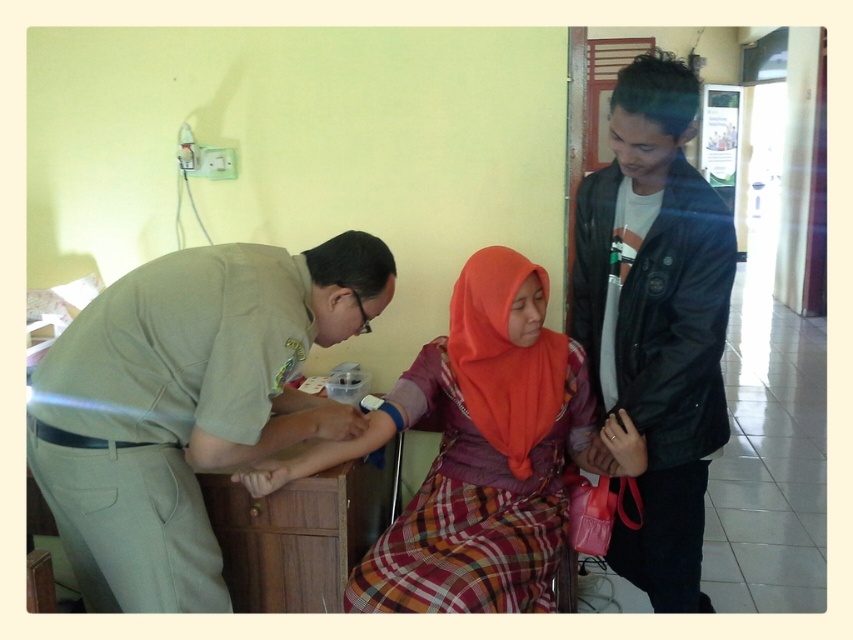
You are a medical technician in the facility. You need to place a small medical kit between the two points labeled point [132,308] and point [604,276]. Based on their positions, will the kit be closer to the wall or the center of the room?

The kit will be closer to the wall because point [132,308] is in front of point [604,276], meaning it is closer to the observer and thus the wall is behind it.

You are a medical technician standing in the scene. You need to reach the point at coordinates (x=85, y=573) to administer a medication. Can you safely reach this point without moving closer than 5 feet from your current position?

The point at coordinates (x=85, y=573) is 5.17 feet away from the viewer, so yes, you can safely reach it without moving closer than 5 feet since the distance is slightly more than 5 feet.